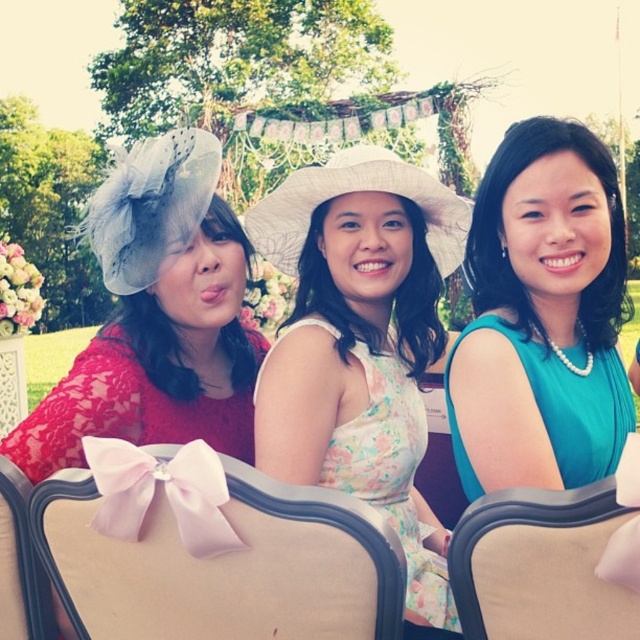
Does floral dress at center appear on the right side of pink fabric chair at center?

Yes, floral dress at center is to the right of pink fabric chair at center.

Is floral dress at center shorter than pink fabric chair at center?

Yes.

Which is behind, point (324, 364) or point (364, 572)?

The point (324, 364) is more distant.

Image resolution: width=640 pixels, height=640 pixels. What are the coordinates of `floral dress at center` in the screenshot? It's located at (360, 342).

Which is behind, point (544, 278) or point (145, 232)?

The point (145, 232) is behind.

Is teal satin dress at center closer to camera compared to lace fabric hat at left?

That is True.

Who is more distant from viewer, (540, 440) or (211, 228)?

Point (211, 228)

Find the location of a particular element. teal satin dress at center is located at coordinates (541, 316).

Who is higher up, lace fabric hat at left or beige fabric chair at lower left?

Positioned higher is lace fabric hat at left.

The height and width of the screenshot is (640, 640). What do you see at coordinates (157, 316) in the screenshot?
I see `lace fabric hat at left` at bounding box center [157, 316].

Locate an element on the screen. This screenshot has width=640, height=640. lace fabric hat at left is located at coordinates (157, 316).